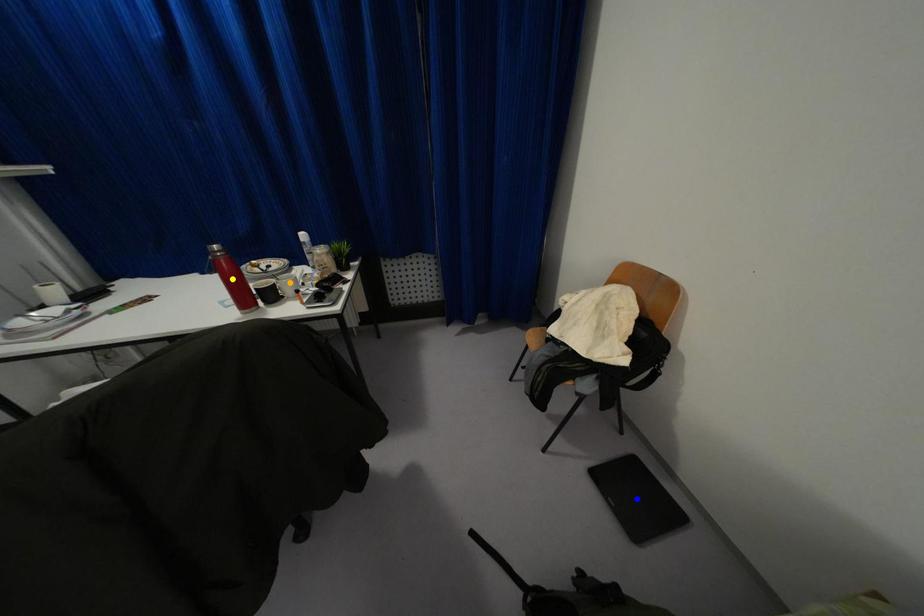
Looking at this image, order these from farthest to nearest:
orange point
blue point
yellow point

orange point → yellow point → blue point